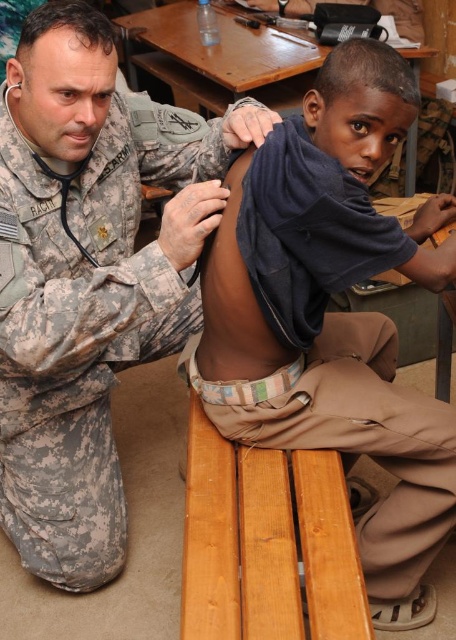
Can you confirm if camouflage uniform at lower left is thinner than wooden picnic table at upper center?

Yes.

Between point (52, 541) and point (226, 19), which one is positioned behind?

Positioned behind is point (226, 19).

Find the location of a particular element. This screenshot has height=640, width=456. camouflage uniform at lower left is located at coordinates (87, 282).

This screenshot has height=640, width=456. In order to click on camouflage uniform at lower left in this screenshot , I will do `click(87, 282)`.

The image size is (456, 640). Describe the element at coordinates (335, 317) in the screenshot. I see `dark blue fabric at upper center` at that location.

Is dark blue fabric at upper center above wooden picnic table at upper center?

Actually, dark blue fabric at upper center is below wooden picnic table at upper center.

The width and height of the screenshot is (456, 640). Identify the location of dark blue fabric at upper center. (335, 317).

Identify the location of dark blue fabric at upper center. (335, 317).

Does point (218, 168) come farther from viewer compared to point (405, 70)?

Yes, it is.

Can you confirm if camouflage uniform at lower left is smaller than dark blue fabric at upper center?

Incorrect, camouflage uniform at lower left is not smaller in size than dark blue fabric at upper center.

Which is behind, point (171, 241) or point (254, 323)?

The point (254, 323) is more distant.

Locate an element on the screen. camouflage uniform at lower left is located at coordinates (87, 282).